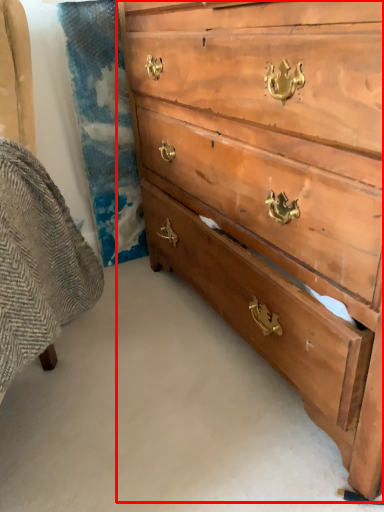
Question: Where is chest of drawers (annotated by the red box) located in relation to swivel chair in the image?

Choices:
 (A) right
 (B) left

Answer: (A)